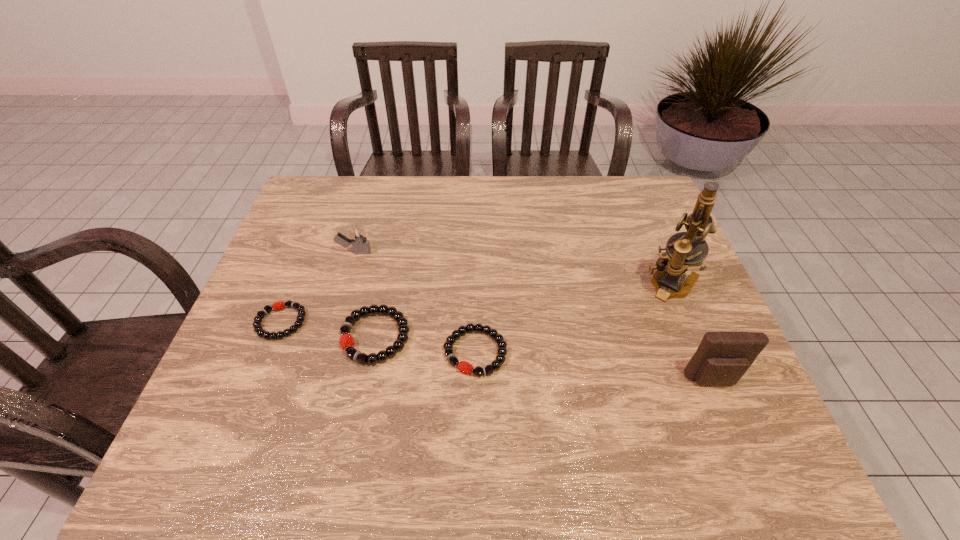
The height and width of the screenshot is (540, 960). What are the coordinates of `free space located on the right of the second bracelet from left to right` in the screenshot? It's located at (489, 336).

You are a GUI agent. You are given a task and a screenshot of the screen. Output one action in this format:
    pyautogui.click(x=<x>, y=<y>)
    Task: Click on the vacant region located on the left of the second tallest bracelet
    The height and width of the screenshot is (540, 960).
    Given the screenshot: What is the action you would take?
    (349, 352)

The width and height of the screenshot is (960, 540). Identify the location of blank space located on the back of the tallest object. click(x=631, y=184).

You are a GUI agent. You are given a task and a screenshot of the screen. Output one action in this format:
    pyautogui.click(x=<x>, y=<y>)
    Task: Click on the vacant space located on the right of the igniter
    The image size is (960, 540).
    Given the screenshot: What is the action you would take?
    pyautogui.click(x=416, y=253)

At what (x,y) coordinates should I click in order to perform the action: click on object that is at the near edge. Please return your answer as a coordinate pair (x, y). The width and height of the screenshot is (960, 540). Looking at the image, I should click on [x=722, y=358].

Where is `object that is at the left edge`? This screenshot has width=960, height=540. object that is at the left edge is located at coordinates (279, 305).

Locate an element on the screen. Image resolution: width=960 pixels, height=540 pixels. microscope that is positioned at the right edge is located at coordinates (687, 249).

This screenshot has width=960, height=540. Identify the location of pouch that is at the right edge. (722, 358).

The image size is (960, 540). What are the coordinates of `object present at the near right corner` in the screenshot? It's located at (722, 358).

Identify the location of free space at the far edge of the desktop. (569, 202).